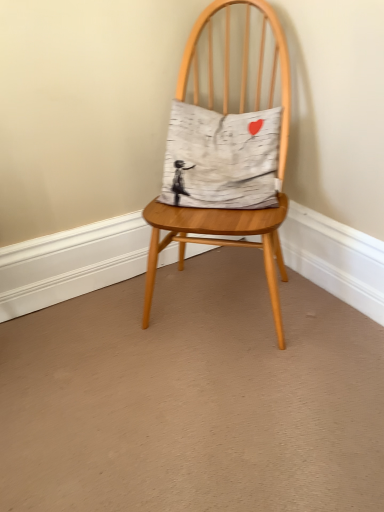
Question: Would you say wooden chair at center is outside white cotton pillow at center?

Choices:
 (A) yes
 (B) no

Answer: (A)

Question: Can you confirm if wooden chair at center is bigger than white cotton pillow at center?

Choices:
 (A) no
 (B) yes

Answer: (B)

Question: From a real-world perspective, does wooden chair at center stand above white cotton pillow at center?

Choices:
 (A) no
 (B) yes

Answer: (A)

Question: Is wooden chair at center far from white cotton pillow at center?

Choices:
 (A) yes
 (B) no

Answer: (B)

Question: Can you confirm if wooden chair at center is taller than white cotton pillow at center?

Choices:
 (A) no
 (B) yes

Answer: (B)

Question: Is wooden chair at center to the right of white cotton pillow at center from the viewer's perspective?

Choices:
 (A) no
 (B) yes

Answer: (B)

Question: Is white cotton pillow at center smaller than wooden chair at center?

Choices:
 (A) yes
 (B) no

Answer: (A)

Question: Is wooden chair at center at the back of white cotton pillow at center?

Choices:
 (A) yes
 (B) no

Answer: (A)

Question: Considering the relative sizes of white cotton pillow at center and wooden chair at center in the image provided, is white cotton pillow at center thinner than wooden chair at center?

Choices:
 (A) yes
 (B) no

Answer: (A)

Question: Does white cotton pillow at center come behind wooden chair at center?

Choices:
 (A) no
 (B) yes

Answer: (B)

Question: Is white cotton pillow at center bigger than wooden chair at center?

Choices:
 (A) no
 (B) yes

Answer: (A)

Question: Does white cotton pillow at center turn towards wooden chair at center?

Choices:
 (A) no
 (B) yes

Answer: (B)

Question: In terms of width, does wooden chair at center look wider or thinner when compared to white cotton pillow at center?

Choices:
 (A) wide
 (B) thin

Answer: (A)